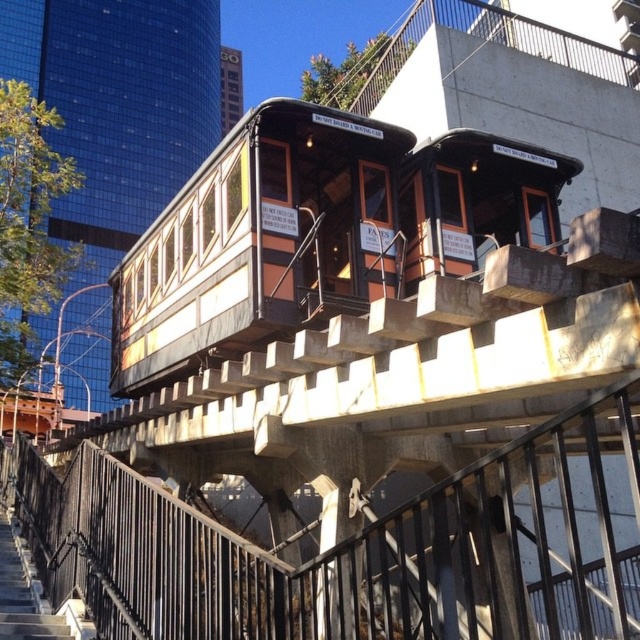
Question: Does wooden passenger train at center appear on the left side of wooden stairs at lower left?

Choices:
 (A) no
 (B) yes

Answer: (A)

Question: Is wooden passenger train at center positioned in front of wooden stairs at lower left?

Choices:
 (A) yes
 (B) no

Answer: (A)

Question: Which point is farther from the camera taking this photo?

Choices:
 (A) (29, 627)
 (B) (509, 161)

Answer: (B)

Question: Is wooden passenger train at center positioned in front of wooden stairs at lower left?

Choices:
 (A) yes
 (B) no

Answer: (A)